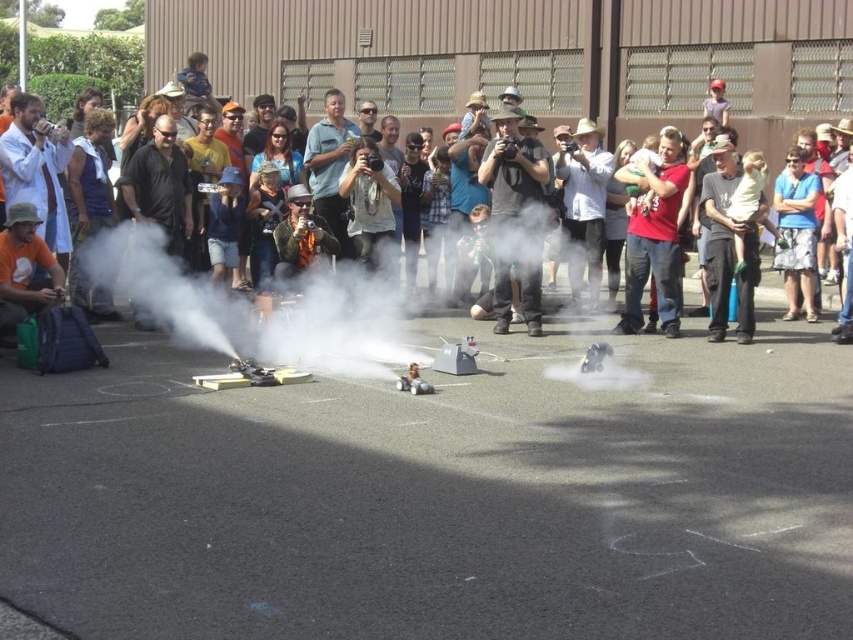
You are a photographer standing at the edge of the crowd, aiming to capture a closeup shot of the matte gray shirt at center and the blue floral shorts at center. If your camera has a minimum focusing distance of 5 feet, will you be able to take the photo without moving closer?

The matte gray shirt at center is 4.80 feet away from the blue floral shorts at center. Since the minimum focusing distance is 5 feet, the photographer needs to move slightly closer to ensure both subjects are within range for a clear closeup.

You are a photographer at the RC car event. You need to capture a photo of the red cotton shirt at center and the matte black camera at center. Which object is positioned higher in the frame?

The matte black camera at center is located above the red cotton shirt at center, so it is positioned higher in the frame.